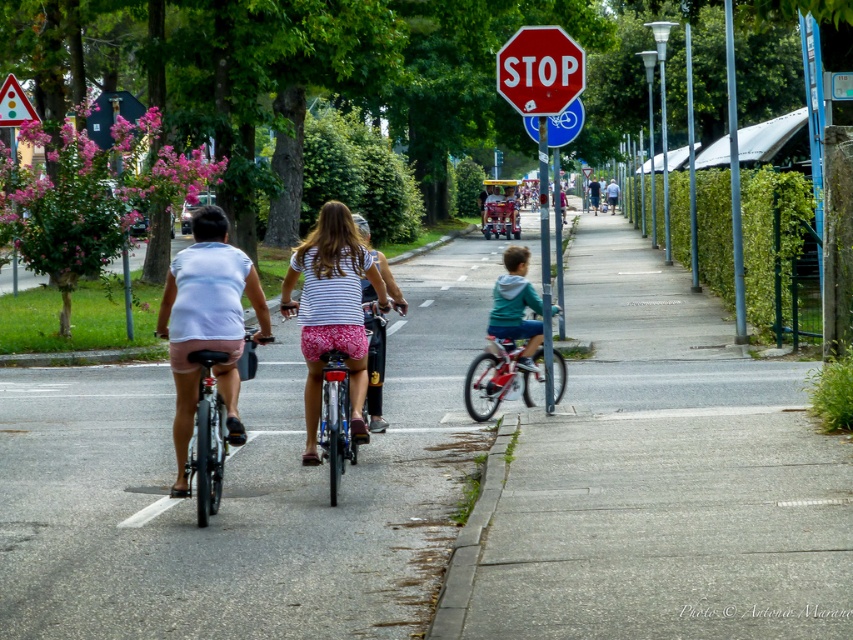
Which is in front, point (334, 342) or point (560, 124)?

Point (334, 342) is more forward.

Between striped fabric shirt at center and blue metallic bicycle at upper center, which one is positioned higher?

Positioned higher is blue metallic bicycle at upper center.

The image size is (853, 640). I want to click on striped fabric shirt at center, so click(x=331, y=310).

Is point (612, 490) closer to camera compared to point (339, 230)?

Yes.

Between smooth asphalt road at center and striped fabric shirt at center, which one has more height?

With more height is smooth asphalt road at center.

The height and width of the screenshot is (640, 853). Identify the location of smooth asphalt road at center. coord(242,492).

This screenshot has width=853, height=640. What do you see at coordinates (502, 378) in the screenshot?
I see `shiny red bicycle at center` at bounding box center [502, 378].

Who is shorter, shiny red bicycle at center or white matte bicycle helmet at center?

shiny red bicycle at center

Which is in front, point (553, 365) or point (366, 227)?

Positioned in front is point (366, 227).

Where is `shiny red bicycle at center`? shiny red bicycle at center is located at coordinates (502, 378).